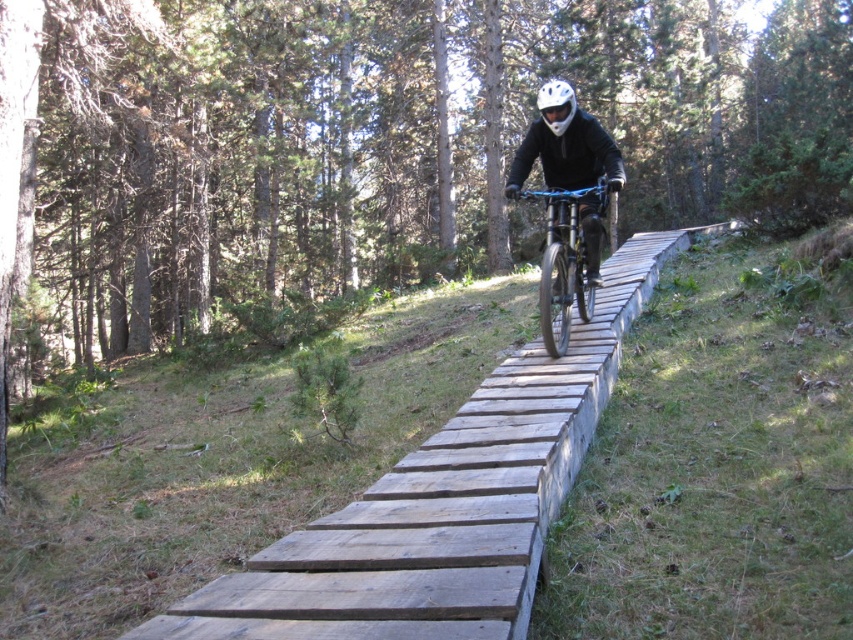
You are a photographer trying to capture the mountain biker in the forest. You notice two helmets at the center of the image. Which helmet, the matte black helmet at center or the white matte helmet at center, is closer to the camera?

The matte black helmet at center is closer to the camera because it is in front of the white matte helmet at center.